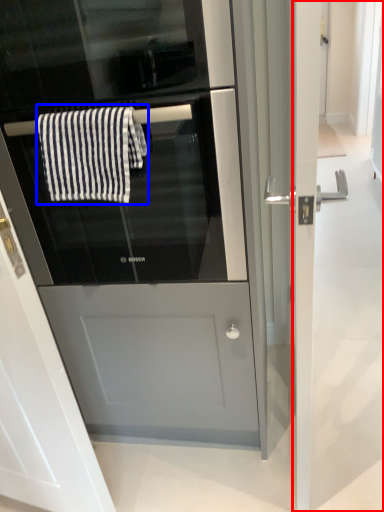
Question: Which of the following is the farthest to the observer, screen door (highlighted by a red box) or bath towel (highlighted by a blue box)?

Choices:
 (A) screen door
 (B) bath towel

Answer: (B)